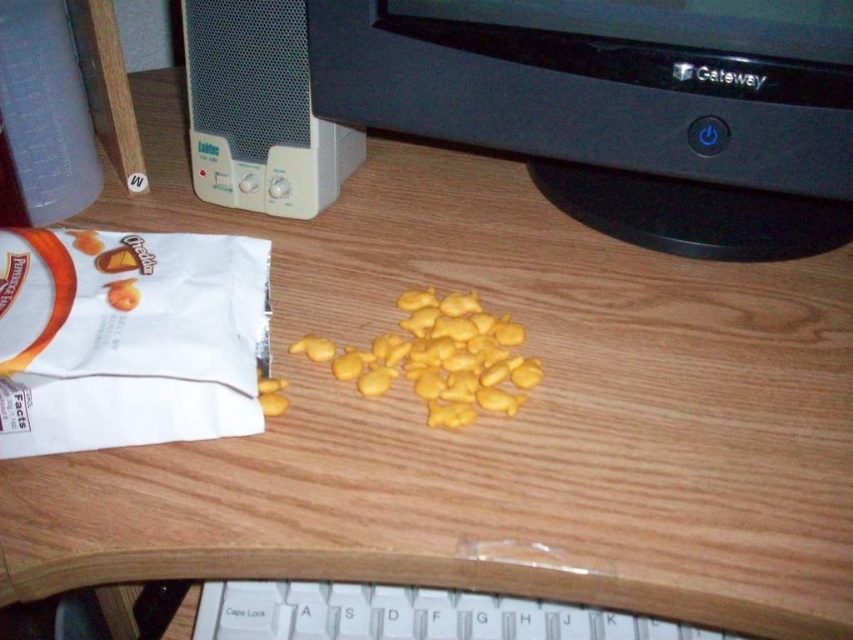
Does black plastic computer monitor at upper center appear on the right side of white plastic keyboard at lower center?

Yes, black plastic computer monitor at upper center is to the right of white plastic keyboard at lower center.

Between black plastic computer monitor at upper center and white plastic keyboard at lower center, which one is positioned higher?

black plastic computer monitor at upper center is higher up.

Is point (682, 35) farther from viewer compared to point (619, 628)?

Yes, it is.

Locate an element on the screen. The width and height of the screenshot is (853, 640). black plastic computer monitor at upper center is located at coordinates (621, 106).

Is white plastic keyboard at lower center bigger than yellow matte snack at center?

No, white plastic keyboard at lower center is not bigger than yellow matte snack at center.

Can you confirm if white plastic keyboard at lower center is wider than yellow matte snack at center?

Yes, white plastic keyboard at lower center is wider than yellow matte snack at center.

Identify the location of white plastic keyboard at lower center. This screenshot has width=853, height=640. (408, 616).

Does black plastic computer monitor at upper center come behind yellow matte snack at center?

Yes, black plastic computer monitor at upper center is further from the viewer.

Locate an element on the screen. black plastic computer monitor at upper center is located at coordinates (621, 106).

Is point (701, 188) less distant than point (444, 307)?

No, it is not.

Identify the location of black plastic computer monitor at upper center. (621, 106).